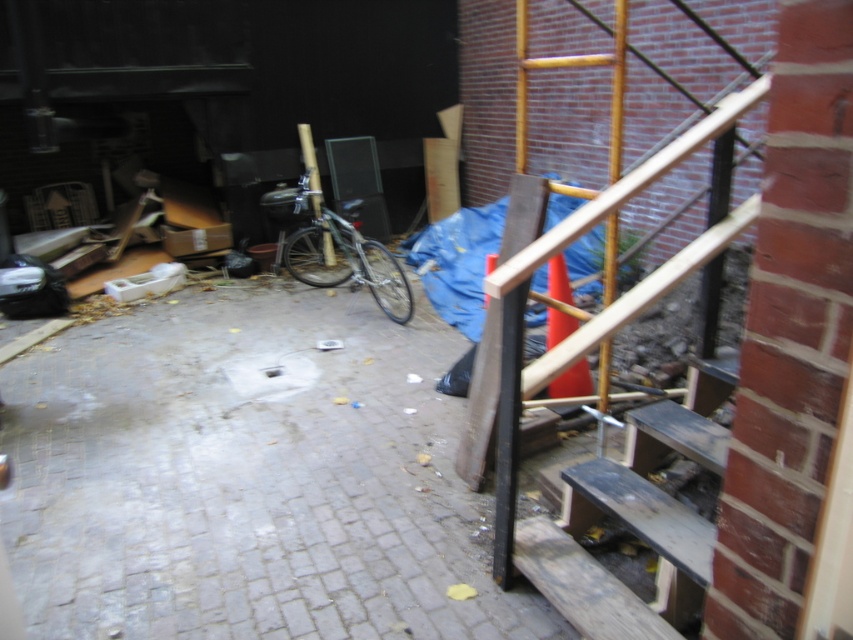
Question: Is dark brown wooden stairs at lower right positioned at the back of shiny metallic bicycle at center?

Choices:
 (A) yes
 (B) no

Answer: (B)

Question: Which object appears farthest from the camera in this image?

Choices:
 (A) shiny metallic bicycle at center
 (B) wooden at right

Answer: (A)

Question: Does wooden at right appear under shiny metallic bicycle at center?

Choices:
 (A) yes
 (B) no

Answer: (A)

Question: Which point is farther to the camera?

Choices:
 (A) (593, 472)
 (B) (682, 637)

Answer: (A)

Question: Which point appears closest to the camera in this image?

Choices:
 (A) (619, 17)
 (B) (357, 214)

Answer: (A)

Question: Does wooden at right appear over dark brown wooden stairs at lower right?

Choices:
 (A) yes
 (B) no

Answer: (A)